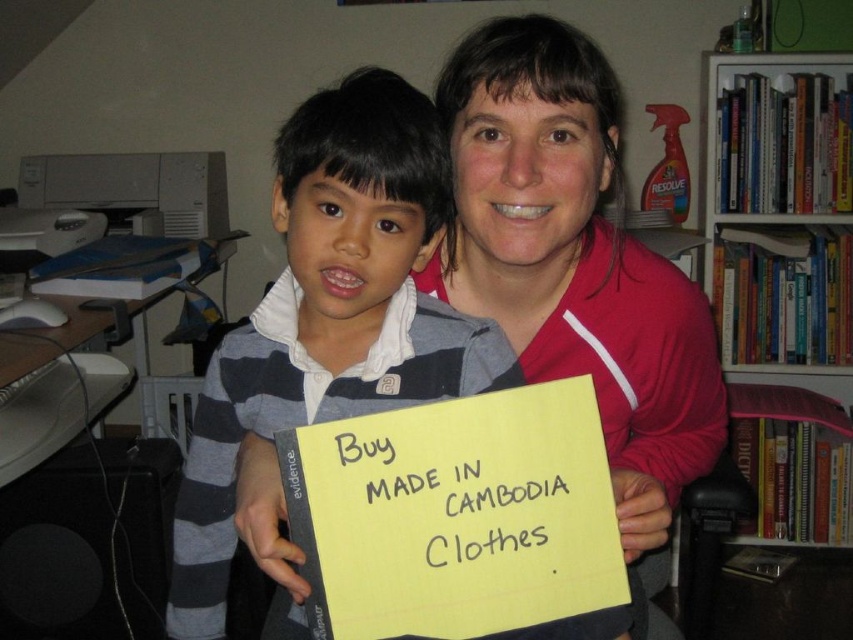
In the scene shown: You are a photographer setting up a shot in this room. You need to place a tripod between the matte red jacket at center and the white paperboard bookshelf at upper right. Based on their positions, which object should the tripod be closer to?

The matte red jacket at center is positioned on the left side of the white paperboard bookshelf at upper right, so the tripod should be placed closer to the matte red jacket at center since it is the leftmost object in this arrangement.

You are an interior designer assessing the space for a new sofa. You notice the matte red jacket at center and the white paperboard bookshelf at upper right. Which object has a smaller width?

The matte red jacket at center is thinner than the white paperboard bookshelf at upper right, so the matte red jacket at center has a smaller width.

You are organizing a room and need to place a new item between the white paperboard bookshelf at upper right and the yellow paper at center. According to their positions, where should you place the new item to ensure it doesn not block the view of both objects?

The white paperboard bookshelf at upper right is positioned over the yellow paper at center. To avoid blocking the view of both, place the new item below the yellow paper at center so it remains visible beneath the bookshelf.